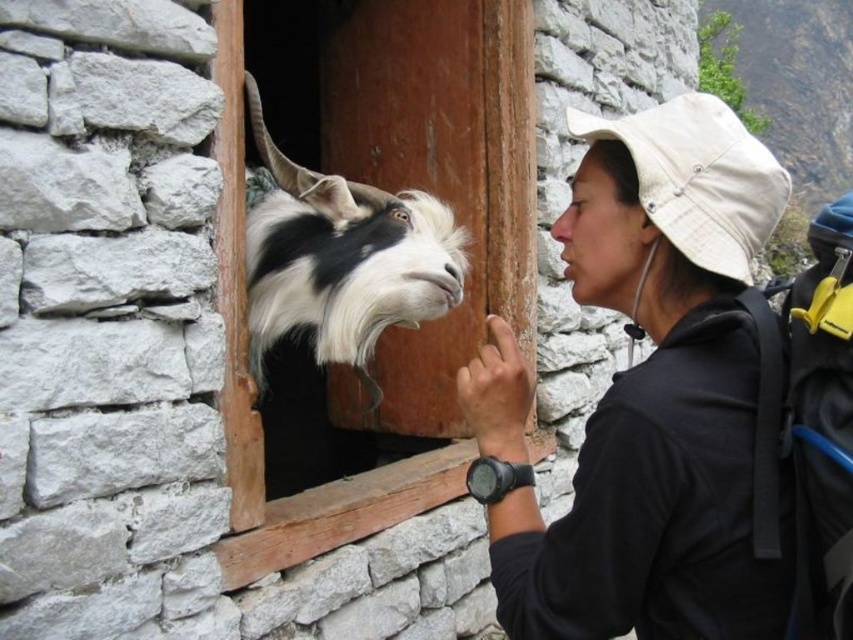
Question: Can you confirm if wooden door at center is smaller than black and white fur at window center?

Choices:
 (A) no
 (B) yes

Answer: (A)

Question: Which object is closer to the camera taking this photo?

Choices:
 (A) black matte hat at upper right
 (B) wooden door at center
 (C) pink smooth skin at center

Answer: (A)

Question: Estimate the real-world distances between objects in this image. Which object is farther from the black and white fur at window center?

Choices:
 (A) pink smooth skin at center
 (B) wooden door at center
 (C) black matte hat at upper right

Answer: (C)

Question: Can you confirm if black matte hat at upper right is thinner than black and white fur at window center?

Choices:
 (A) no
 (B) yes

Answer: (B)

Question: Can you confirm if wooden door at center is positioned to the right of black and white fur at window center?

Choices:
 (A) yes
 (B) no

Answer: (A)

Question: Considering the real-world distances, which object is closest to the black matte hat at upper right?

Choices:
 (A) wooden door at center
 (B) black and white fur at window center
 (C) pink smooth skin at center

Answer: (C)